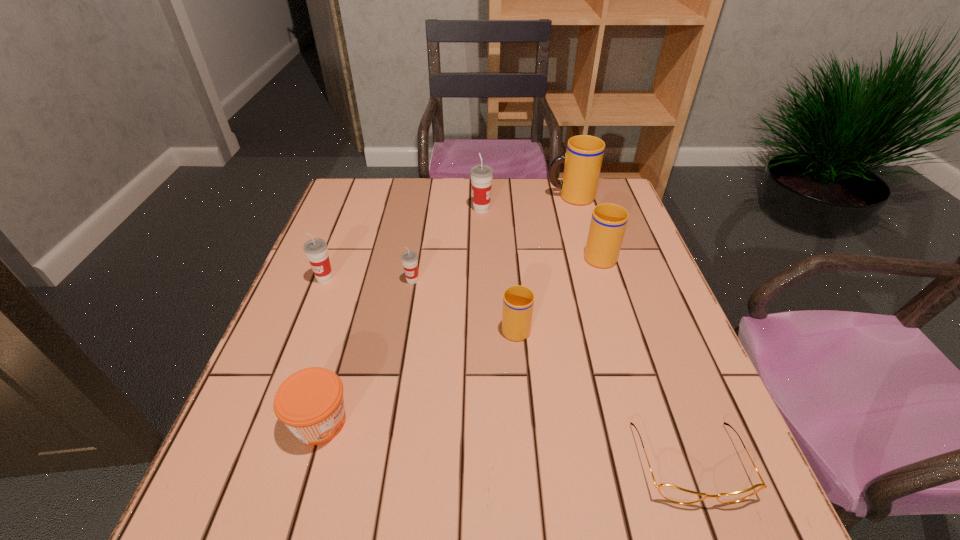
What are the coordinates of `free location that satisfies the following two spatial constraints: 1. on the side of the fourth object from right to left with the handle; 2. on the side of the fifth object from right to left with the logo` in the screenshot? It's located at (506, 209).

The width and height of the screenshot is (960, 540). I want to click on vacant region that satisfies the following two spatial constraints: 1. on the side of the fourth cup from left to right with the handle; 2. on the side of the biggest beige cup with the handle, so click(505, 197).